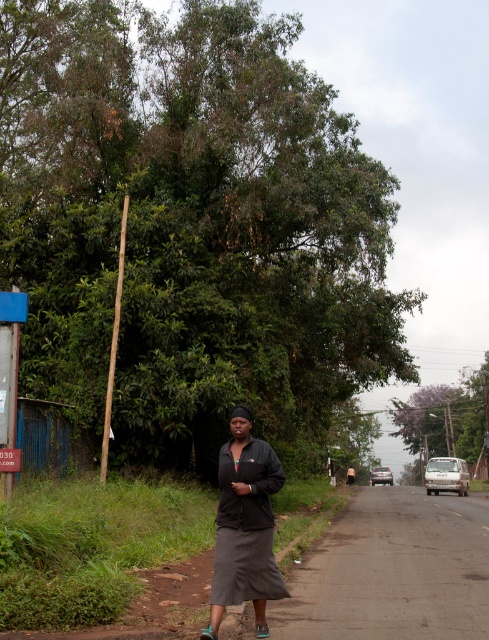
Between dark gray fabric dress at center and brown fabric shirt at center, which one appears on the right side from the viewer's perspective?

From the viewer's perspective, brown fabric shirt at center appears more on the right side.

Is point (246, 564) behind point (348, 472)?

No.

Between point (217, 509) and point (353, 480), which one is positioned in front?

Positioned in front is point (217, 509).

Identify the location of dark gray fabric dress at center. This screenshot has height=640, width=489. pos(244,525).